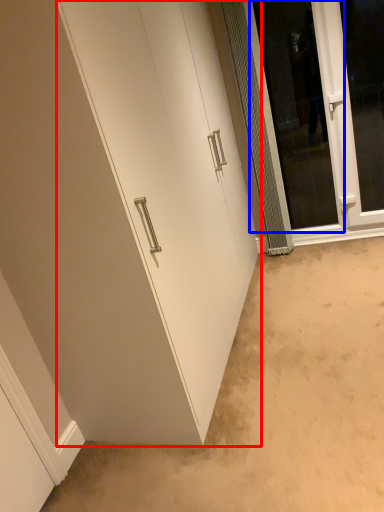
Question: Which object appears farthest to the camera in this image, door (highlighted by a red box) or screen door (highlighted by a blue box)?

Choices:
 (A) door
 (B) screen door

Answer: (B)